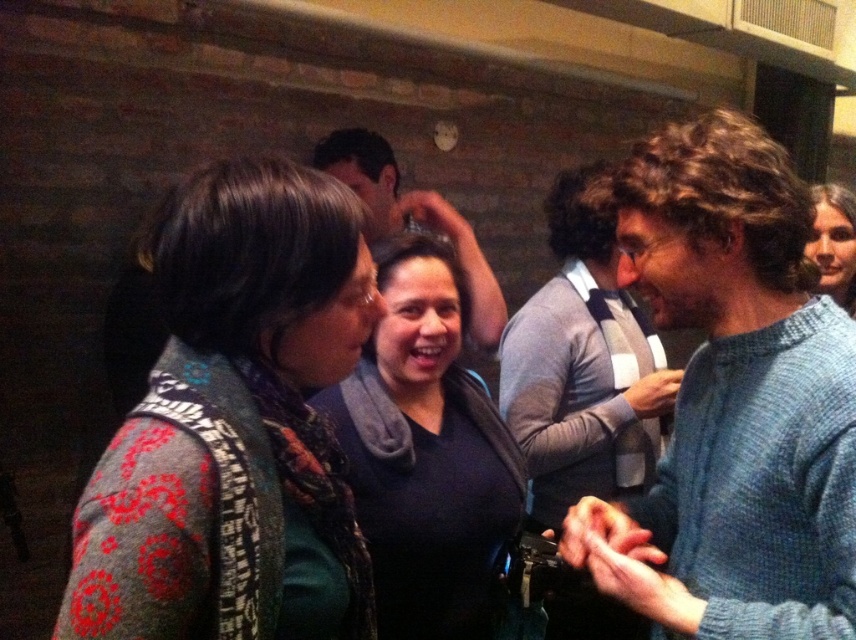
Question: Considering the real-world distances, which object is farthest from the dark blue sweater at center?

Choices:
 (A) knitted sweater at left
 (B) smooth skin face at upper right

Answer: (B)

Question: Which point is farther from the camera taking this photo?

Choices:
 (A) (846, 230)
 (B) (203, 264)

Answer: (A)

Question: Observing the image, what is the correct spatial positioning of knitted sweater at left in reference to dark blue sweater at center?

Choices:
 (A) right
 (B) left

Answer: (B)

Question: Where is dark blue sweater at center located in relation to smooth skin face at upper right in the image?

Choices:
 (A) left
 (B) right

Answer: (A)

Question: Is dark blue sweater at center wider than smooth skin face at upper right?

Choices:
 (A) yes
 (B) no

Answer: (A)

Question: Which of the following is the closest to the observer?

Choices:
 (A) knitted sweater at left
 (B) dark blue sweater at center

Answer: (A)